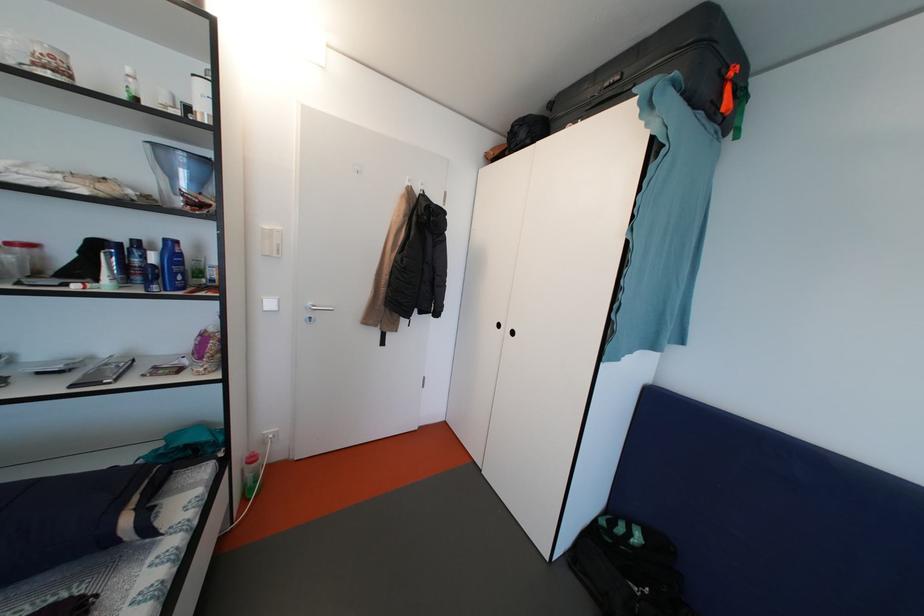
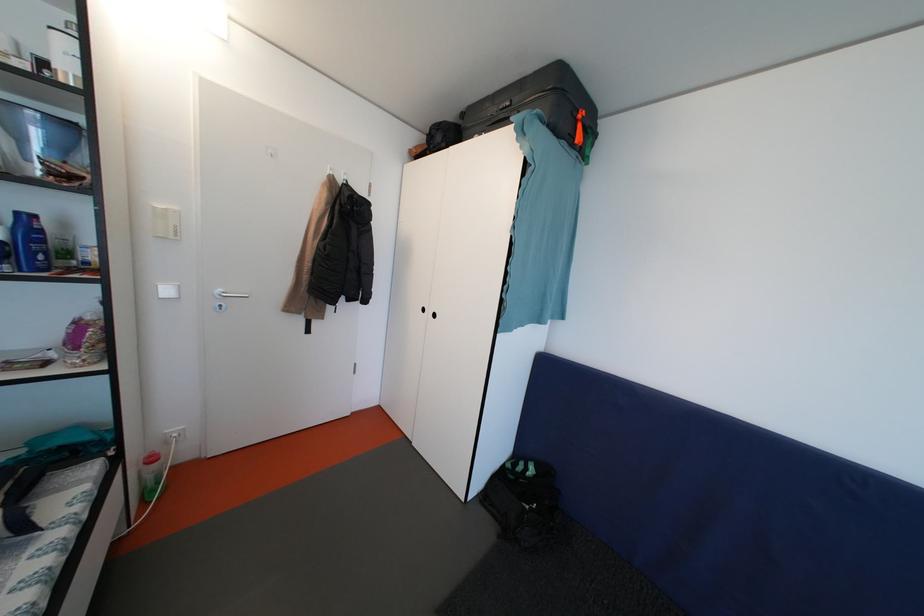
Find the pixel in the second image that matches point (629, 79) in the first image.

(518, 107)